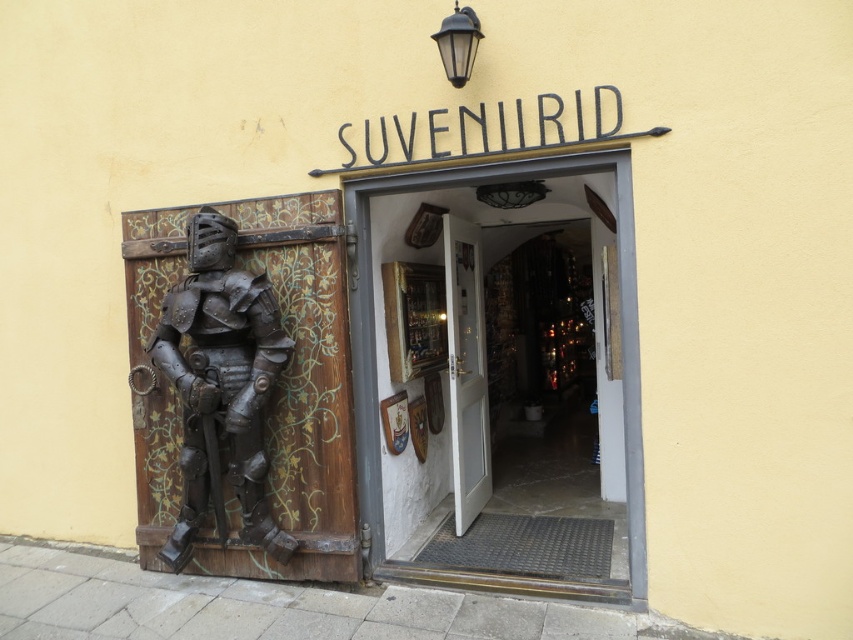
Question: Which object appears closest to the camera in this image?

Choices:
 (A) white wooden door at center
 (B) bronze armor at left
 (C) wooden door at center

Answer: (C)

Question: Which point is closer to the camera?

Choices:
 (A) wooden door at center
 (B) bronze armor at left
 (C) white wooden door at center

Answer: (A)

Question: Does bronze armor at left have a smaller size compared to white wooden door at center?

Choices:
 (A) yes
 (B) no

Answer: (B)

Question: Does bronze armor at left appear on the right side of wooden door at center?

Choices:
 (A) no
 (B) yes

Answer: (A)

Question: Among these objects, which one is farthest from the camera?

Choices:
 (A) white wooden door at center
 (B) wooden door at center
 (C) bronze armor at left

Answer: (A)

Question: Is bronze armor at left smaller than white wooden door at center?

Choices:
 (A) yes
 (B) no

Answer: (B)